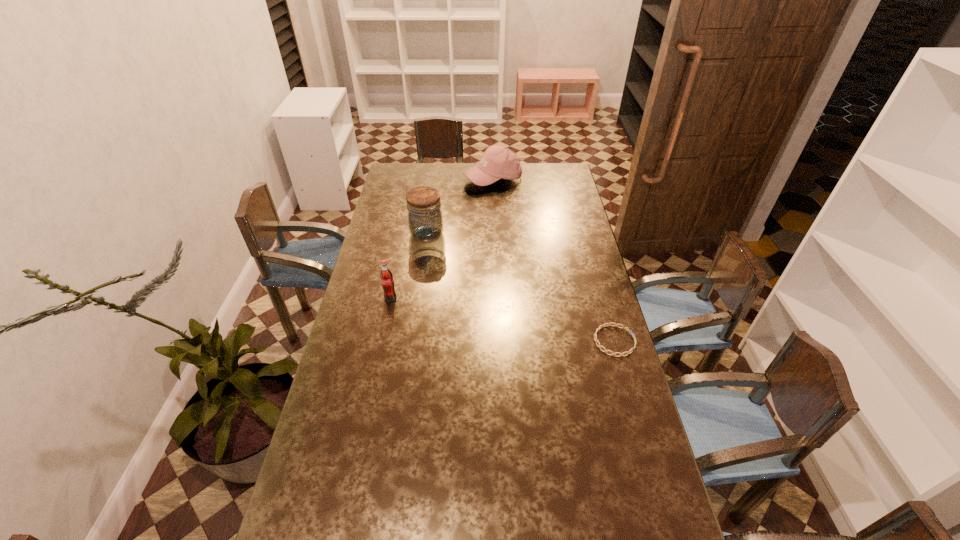
In the image, there is a desktop. What are the coordinates of `blank space at the left edge` in the screenshot? It's located at (355, 315).

What are the coordinates of `free space at the right edge of the desktop` in the screenshot? It's located at (x=560, y=197).

In the image, there is a desktop. Find the location of `free space at the near left corner`. free space at the near left corner is located at coordinates (306, 527).

This screenshot has height=540, width=960. What are the coordinates of `vacant space at the far right corner` in the screenshot? It's located at (565, 186).

This screenshot has width=960, height=540. Find the location of `vacant space at the near right corner of the desktop`. vacant space at the near right corner of the desktop is located at coordinates click(x=625, y=526).

This screenshot has width=960, height=540. Find the location of `empty space between the leftmost object and the third object from right to left`. empty space between the leftmost object and the third object from right to left is located at coordinates (409, 266).

Find the location of a particular element. unoccupied position between the baseball cap and the second object from left to right is located at coordinates (460, 207).

Locate an element on the screen. vacant area that lies between the jar and the shortest object is located at coordinates (520, 288).

The image size is (960, 540). Identify the location of free point between the second farthest object and the rightmost object. pyautogui.click(x=520, y=288).

Image resolution: width=960 pixels, height=540 pixels. I want to click on empty space that is in between the shortest object and the leftmost object, so click(x=502, y=319).